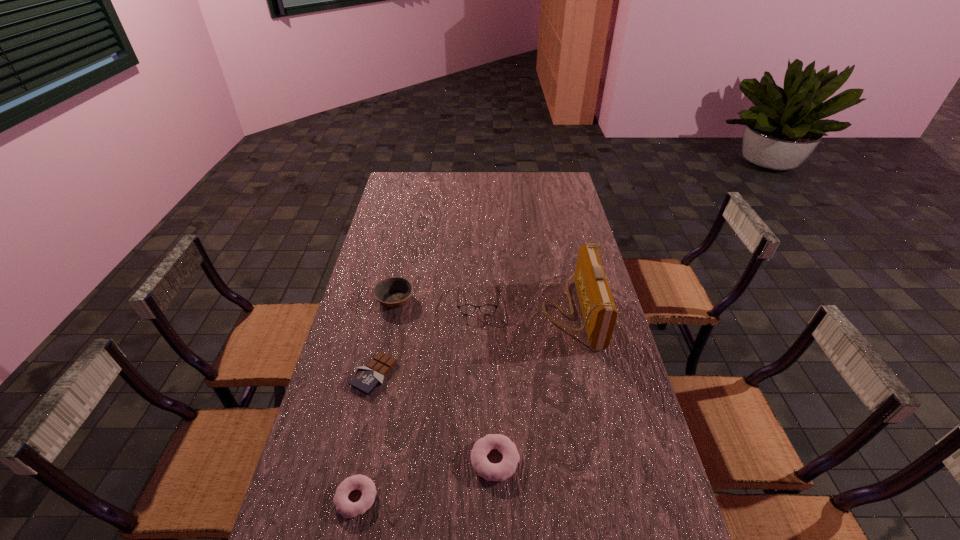
With all doughnuts evenly spaced, where should an extra doughnut be placed on the right to continue the pattern? Please point out a vacant space. Please provide its 2D coordinates. Your answer should be formatted as a tuple, i.e. [(x, y)], where the tuple contains the x and y coordinates of a point satisfying the conditions above.

[(617, 427)]